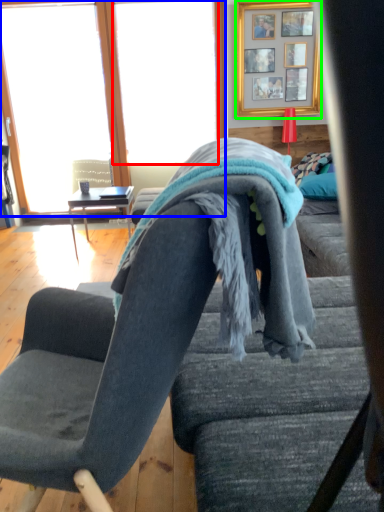
Question: Considering the real-world distances, which object is farthest from window screen (highlighted by a red box)? window (highlighted by a blue box) or picture frame (highlighted by a green box)?

Choices:
 (A) window
 (B) picture frame

Answer: (B)